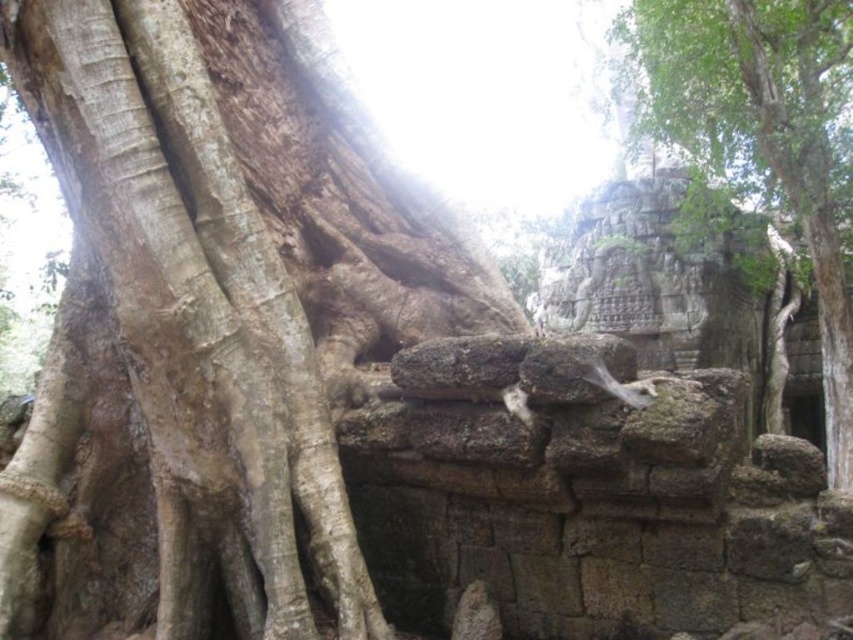
Describe the element at coordinates (193, 316) in the screenshot. The height and width of the screenshot is (640, 853). I see `smooth brown bark at center` at that location.

Is smooth brown bark at center wider than green rough stone wall at upper right?

No, smooth brown bark at center is not wider than green rough stone wall at upper right.

Locate an element on the screen. smooth brown bark at center is located at coordinates click(193, 316).